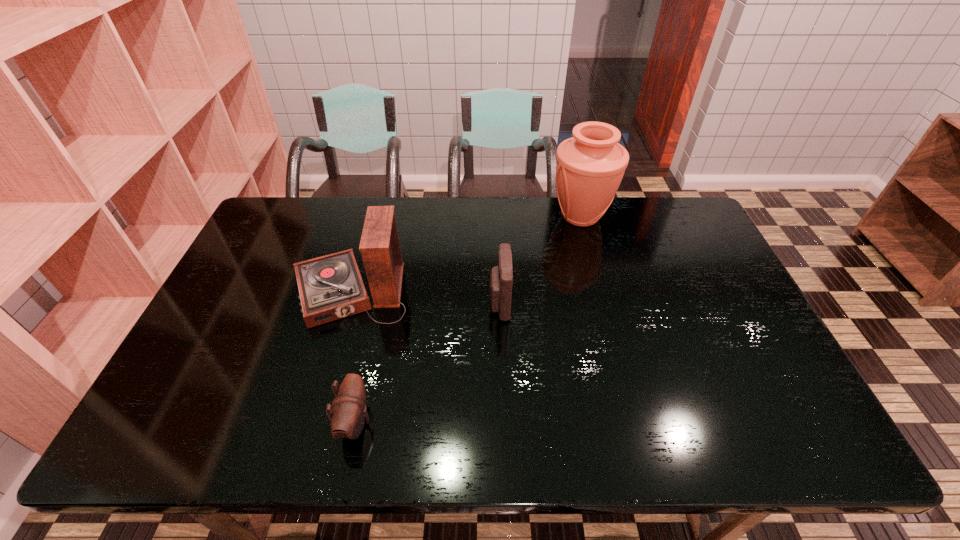
Locate an element on the screen. The height and width of the screenshot is (540, 960). empty space that is in between the second object from right to left and the tallest object is located at coordinates (540, 260).

The width and height of the screenshot is (960, 540). In order to click on empty location between the third tallest object and the rightmost object in this screenshot , I will do `click(540, 260)`.

Point out which object is positioned as the third nearest to the second tallest object. Please provide its 2D coordinates. Your answer should be formatted as a tuple, i.e. [(x, y)], where the tuple contains the x and y coordinates of a point satisfying the conditions above.

[(590, 166)]

Choose which object is the third nearest neighbor to the second object from right to left. Please provide its 2D coordinates. Your answer should be formatted as a tuple, i.e. [(x, y)], where the tuple contains the x and y coordinates of a point satisfying the conditions above.

[(349, 413)]

Where is `free spot that satisfies the following two spatial constraints: 1. on the back side of the phonograph record; 2. on the left side of the vase`? free spot that satisfies the following two spatial constraints: 1. on the back side of the phonograph record; 2. on the left side of the vase is located at coordinates (372, 217).